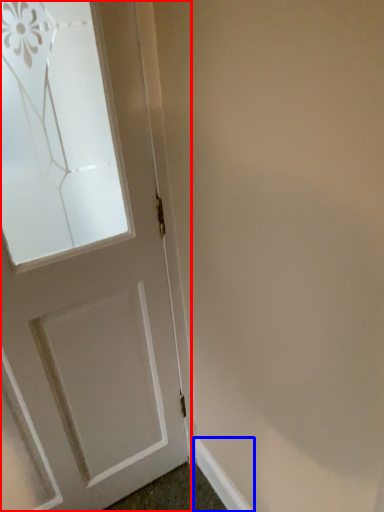
Question: Which object is closer to the camera taking this photo, door (highlighted by a red box) or molding (highlighted by a blue box)?

Choices:
 (A) door
 (B) molding

Answer: (A)